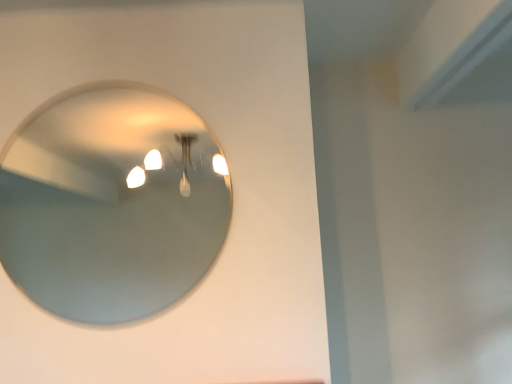
What do you see at coordinates (111, 204) in the screenshot?
I see `shiny metallic mirror at upper left` at bounding box center [111, 204].

Locate an element on the screen. Image resolution: width=512 pixels, height=384 pixels. shiny metallic mirror at upper left is located at coordinates (111, 204).

Locate an element on the screen. Image resolution: width=512 pixels, height=384 pixels. shiny metallic mirror at upper left is located at coordinates [111, 204].